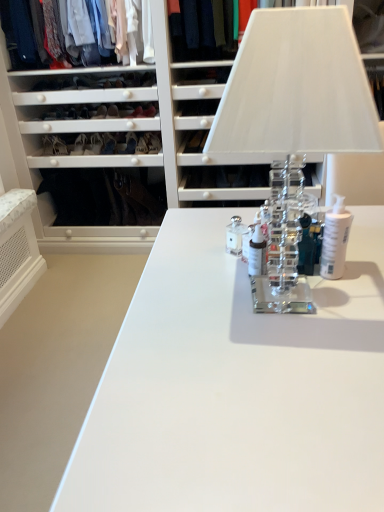
Question: Is matte black shoe at center, the second shoe from the right, touching clear glass toiletry at center, arranged as the 1th toiletry when viewed from the left?

Choices:
 (A) yes
 (B) no

Answer: (B)

Question: Can you confirm if matte black shoe at center, placed as the 2th shoe when sorted from left to right, is bigger than clear glass toiletry at center, arranged as the 1th toiletry when viewed from the left?

Choices:
 (A) yes
 (B) no

Answer: (A)

Question: Can you confirm if matte black shoe at center, placed as the 2th shoe when sorted from left to right, is positioned to the left of clear glass toiletry at center, arranged as the 1th toiletry when viewed from the left?

Choices:
 (A) yes
 (B) no

Answer: (A)

Question: Is matte black shoe at center, the second shoe from the right, oriented towards clear glass toiletry at center, the 3th toiletry in the right-to-left sequence?

Choices:
 (A) no
 (B) yes

Answer: (A)

Question: Is matte black shoe at center, placed as the 2th shoe when sorted from left to right, to the right of clear glass toiletry at center, arranged as the 1th toiletry when viewed from the left, from the viewer's perspective?

Choices:
 (A) yes
 (B) no

Answer: (B)

Question: From a real-world perspective, is clear glass table lamp at center above or below clear glass toiletry at center, arranged as the 1th toiletry when viewed from the left?

Choices:
 (A) below
 (B) above

Answer: (B)

Question: Is clear glass table lamp at center wider or thinner than clear glass toiletry at center, the 3th toiletry in the right-to-left sequence?

Choices:
 (A) thin
 (B) wide

Answer: (B)

Question: Looking at the image, does clear glass table lamp at center seem bigger or smaller compared to clear glass toiletry at center, the 3th toiletry in the right-to-left sequence?

Choices:
 (A) big
 (B) small

Answer: (A)

Question: From the image's perspective, is clear glass table lamp at center located above or below clear glass toiletry at center, the 3th toiletry in the right-to-left sequence?

Choices:
 (A) below
 (B) above

Answer: (B)

Question: Does point (226, 29) appear closer or farther from the camera than point (331, 12)?

Choices:
 (A) farther
 (B) closer

Answer: (A)

Question: From the image's perspective, is dark blue fabric at upper center, the 2th clothing viewed from the left, positioned above or below clear glass table lamp at center?

Choices:
 (A) below
 (B) above

Answer: (B)

Question: Is dark blue fabric at upper center, the first clothing positioned from the right, wider or thinner than clear glass table lamp at center?

Choices:
 (A) thin
 (B) wide

Answer: (B)

Question: Is dark blue fabric at upper center, the first clothing positioned from the right, spatially inside clear glass table lamp at center, or outside of it?

Choices:
 (A) inside
 (B) outside

Answer: (B)

Question: From the image's perspective, is matte black shoe at lower left, the first shoe positioned from the left, above or below matte white shirts at upper left, the 1th clothing viewed from the left?

Choices:
 (A) below
 (B) above

Answer: (A)

Question: From a real-world perspective, is matte black shoe at lower left, arranged as the third shoe when viewed from the right, physically located above or below matte white shirts at upper left, acting as the 2th clothing starting from the right?

Choices:
 (A) below
 (B) above

Answer: (A)